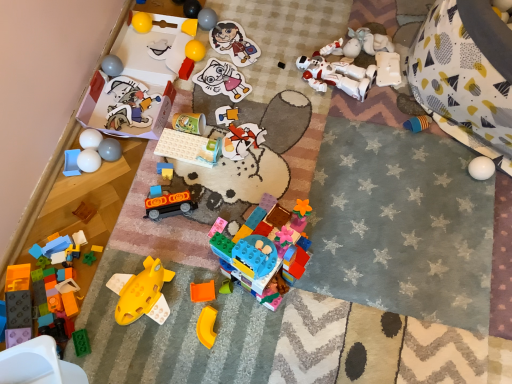
Identify the location of free space that is in between matte paper sticker at center, the eighteenth toy positioned from the left, and white matte robot at center, marked as the third toy in a right-to-left arrangement. (276, 84).